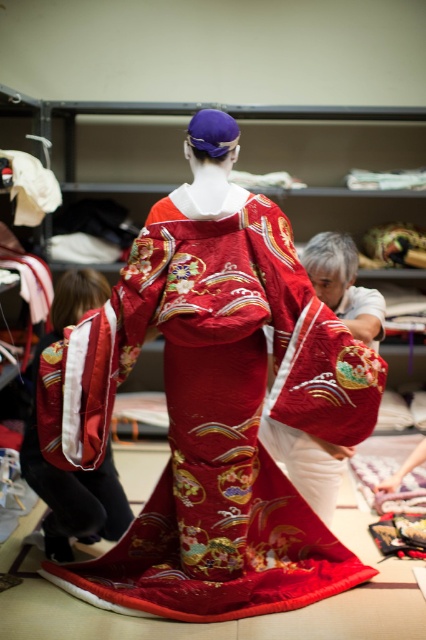
You are a costume designer preparing for a performance. You have two kimonos available, the silky red kimono at center and the velvet red kimono at lower left. Which kimono should you choose if you need a larger one for the main character?

The velvet red kimono at lower left is larger than the silky red kimono at center, so you should choose the velvet red kimono at lower left for the main character.

You are a photographer setting up in a dressing room. You need to position a light source to the left of the silky red kimono at center. Where should you place the light relative to the kimono?

The silky red kimono at center is located at point (x=344, y=285). To place the light source to the left of it, position the light to the left side of the kimono at those coordinates.

You are a costume designer preparing for a performance. You need to choose between the silky red kimono at center and the velvet red kimono at lower left. Which kimono is closer to you, and why?

The silky red kimono at center is closer to you because the velvet red kimono at lower left is behind it.